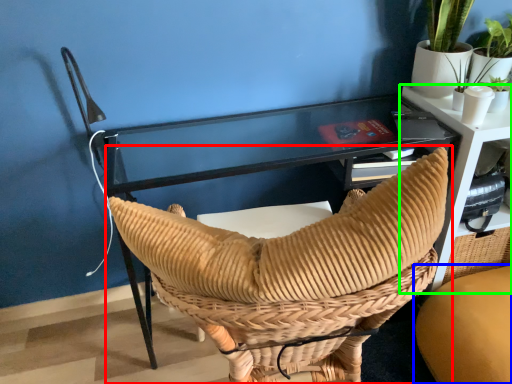
Question: Which object is positioned closest to chair (highlighted by a red box)? Select from chair (highlighted by a blue box) and table (highlighted by a green box).

Choices:
 (A) chair
 (B) table

Answer: (A)